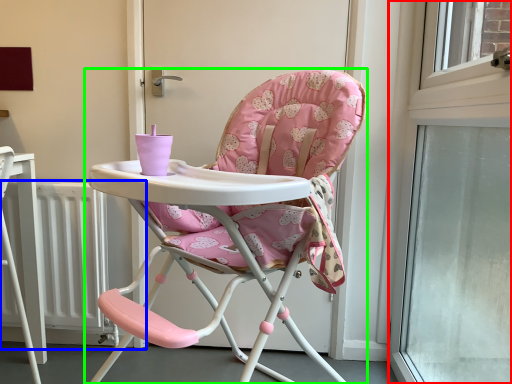
Question: Which is farther away from window (highlighted by a red box)? radiator (highlighted by a blue box) or chair (highlighted by a green box)?

Choices:
 (A) radiator
 (B) chair

Answer: (A)